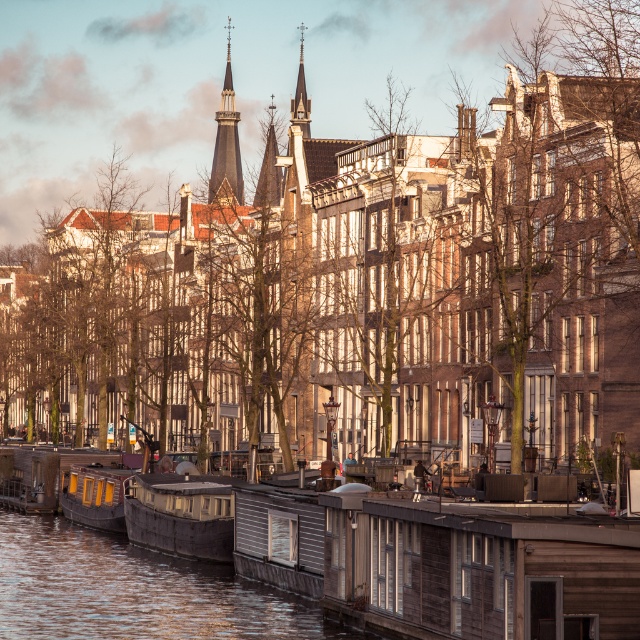
This screenshot has width=640, height=640. Describe the element at coordinates (268, 168) in the screenshot. I see `smooth gray spire at center` at that location.

The height and width of the screenshot is (640, 640). Find the location of `smooth gray spire at center`. smooth gray spire at center is located at coordinates (268, 168).

Locate an element on the screen. The width and height of the screenshot is (640, 640). smooth gray spire at center is located at coordinates (268, 168).

Does wooden boat at center have a greater width compared to smooth stone spire at center?

Yes, wooden boat at center is wider than smooth stone spire at center.

Between wooden boat at center and smooth stone spire at center, which one appears on the left side from the viewer's perspective?

wooden boat at center is more to the left.

What do you see at coordinates (180, 515) in the screenshot? I see `wooden boat at center` at bounding box center [180, 515].

The height and width of the screenshot is (640, 640). What are the coordinates of `wooden boat at center` in the screenshot? It's located at (180, 515).

Does wooden boat at center come behind wooden cabin boat at lower left?

No, it is in front of wooden cabin boat at lower left.

Which is in front, point (148, 500) or point (104, 488)?

Point (148, 500) is in front.

Identify the location of wooden boat at center. (180, 515).